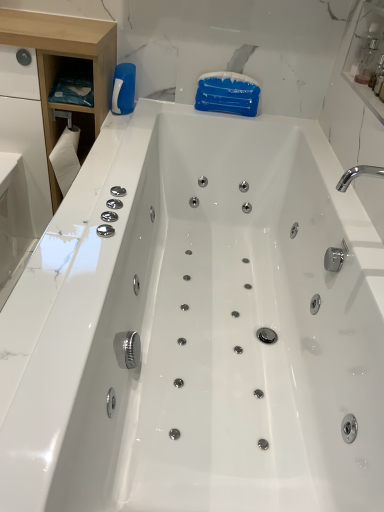
Question: Would you say white wood cabinet at left is inside or outside transparent plastic bottle at upper right?

Choices:
 (A) inside
 (B) outside

Answer: (B)

Question: From the image's perspective, relative to transparent plastic bottle at upper right, is white wood cabinet at left above or below?

Choices:
 (A) above
 (B) below

Answer: (B)

Question: Estimate the real-world distances between objects in this image. Which object is farther from the white paper towel at left?

Choices:
 (A) white wood cabinet at left
 (B) transparent plastic bottle at upper right
 (C) white plastic bottle at upper left

Answer: (B)

Question: Estimate the real-world distances between objects in this image. Which object is closer to the white paper towel at left?

Choices:
 (A) white plastic bottle at upper left
 (B) white wood cabinet at left
 (C) transparent plastic bottle at upper right

Answer: (B)